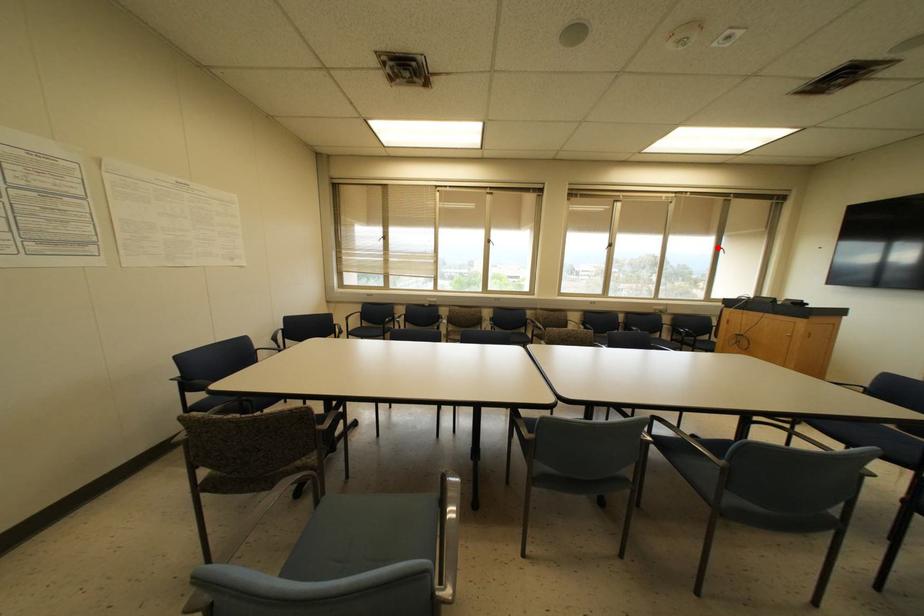
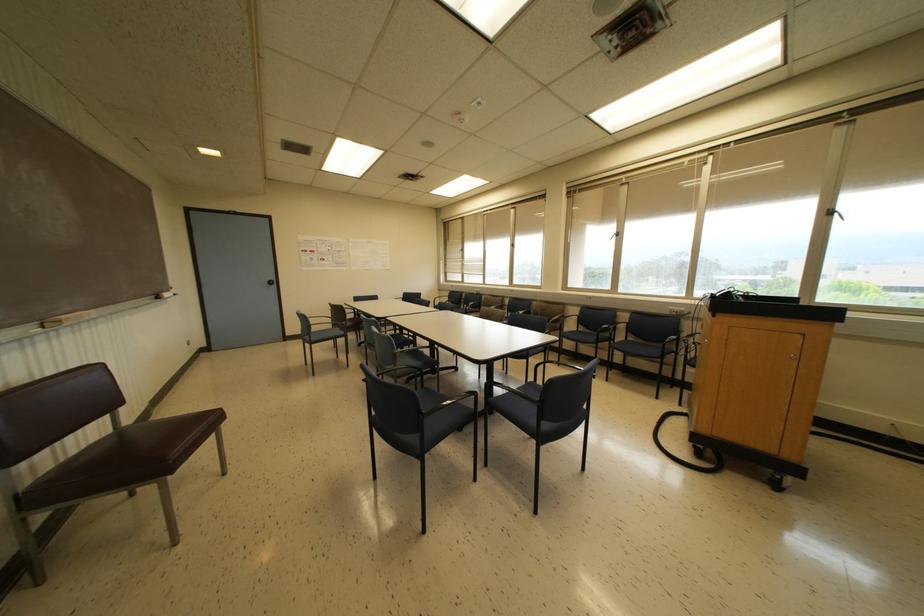
Question: I am providing you with two images of the same scene from different viewpoints. A red point is shown in image1. For the corresponding object point in image2, is it positioned nearer or farther from the camera?

Choices:
 (A) Nearer
 (B) Farther

Answer: (B)